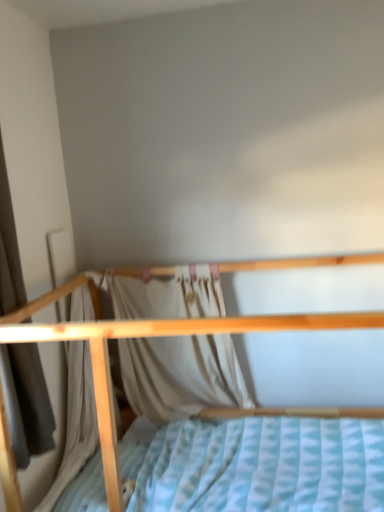
From the picture: Measure the distance between wooden bed at center and camera.

Answer: wooden bed at center and camera are 3.88 feet apart.

Measure the distance between light beige fabric curtain at left, which ranks as the first curtain in left-to-right order, and camera.

light beige fabric curtain at left, which ranks as the first curtain in left-to-right order, is 4.75 feet away from camera.

Based on the photo, measure the distance between point (190, 271) and camera.

Point (190, 271) and camera are 2.30 meters apart from each other.

Locate an element on the screen. The width and height of the screenshot is (384, 512). wooden bed at center is located at coordinates tap(149, 336).

Considering the positions of objects light beige fabric curtain at left, which ranks as the first curtain in front-to-back order, and wooden bed at center in the image provided, who is more to the left, light beige fabric curtain at left, which ranks as the first curtain in front-to-back order, or wooden bed at center?

Positioned to the left is light beige fabric curtain at left, which ranks as the first curtain in front-to-back order.

Measure the distance from light beige fabric curtain at left, which is the second curtain from back to front, to wooden bed at center.

light beige fabric curtain at left, which is the second curtain from back to front, and wooden bed at center are 14.55 inches apart.

From the image's perspective, which curtain is the 2nd one above the wooden bed at center? Please provide its 2D coordinates.

[(26, 401)]

Is white fabric curtain at center, the second curtain when ordered from front to back, bigger than wooden bed at center?

No.

Looking at this image, from the image's perspective, between white fabric curtain at center, which is the 1th curtain in right-to-left order, and wooden bed at center, who is located below?

From the image's view, wooden bed at center is below.

Is white fabric curtain at center, which ranks as the first curtain in back-to-front order, placed right next to wooden bed at center?

No.

Who is shorter, white fabric curtain at center, the second curtain when ordered from front to back, or wooden bed at center?

white fabric curtain at center, the second curtain when ordered from front to back.

Consider the image. Looking at the image, does wooden bed at center seem bigger or smaller compared to light beige fabric curtain at left, which ranks as the first curtain in left-to-right order?

In the image, wooden bed at center appears to be larger than light beige fabric curtain at left, which ranks as the first curtain in left-to-right order.

Is wooden bed at center closer to camera compared to light beige fabric curtain at left, positioned as the 2th curtain in right-to-left order?

Yes, wooden bed at center is in front of light beige fabric curtain at left, positioned as the 2th curtain in right-to-left order.

Is wooden bed at center to the right of light beige fabric curtain at left, which ranks as the first curtain in left-to-right order, from the viewer's perspective?

Correct, you'll find wooden bed at center to the right of light beige fabric curtain at left, which ranks as the first curtain in left-to-right order.

In the scene shown: Considering the relative sizes of light beige fabric curtain at left, which ranks as the first curtain in front-to-back order, and white fabric curtain at center, which is the 1th curtain in right-to-left order, in the image provided, is light beige fabric curtain at left, which ranks as the first curtain in front-to-back order, bigger than white fabric curtain at center, which is the 1th curtain in right-to-left order,?

Indeed, light beige fabric curtain at left, which ranks as the first curtain in front-to-back order, has a larger size compared to white fabric curtain at center, which is the 1th curtain in right-to-left order.

From a real-world perspective, is light beige fabric curtain at left, which ranks as the first curtain in front-to-back order, over white fabric curtain at center, the second curtain when ordered from front to back?

Yes.

Based on the photo, does light beige fabric curtain at left, positioned as the 2th curtain in right-to-left order, have a lesser height compared to white fabric curtain at center, which ranks as the first curtain in back-to-front order?

Incorrect, the height of light beige fabric curtain at left, positioned as the 2th curtain in right-to-left order, does not fall short of that of white fabric curtain at center, which ranks as the first curtain in back-to-front order.

Looking at this image, choose the correct answer: Is light beige fabric curtain at left, which ranks as the first curtain in front-to-back order, inside white fabric curtain at center, the second curtain when ordered from front to back, or outside it?

light beige fabric curtain at left, which ranks as the first curtain in front-to-back order, cannot be found inside white fabric curtain at center, the second curtain when ordered from front to back.

Can you tell me how much white fabric curtain at center, the second curtain when ordered from front to back, and light beige fabric curtain at left, which is the second curtain from back to front, differ in facing direction?

88.8 degrees.

Does point (168, 395) come closer to viewer compared to point (44, 394)?

That is False.

Does white fabric curtain at center, which ranks as the first curtain in back-to-front order, have a lesser width compared to light beige fabric curtain at left, which ranks as the first curtain in left-to-right order?

Correct, the width of white fabric curtain at center, which ranks as the first curtain in back-to-front order, is less than that of light beige fabric curtain at left, which ranks as the first curtain in left-to-right order.

Which of these two, white fabric curtain at center, marked as the second curtain in a left-to-right arrangement, or light beige fabric curtain at left, which ranks as the first curtain in front-to-back order, stands taller?

light beige fabric curtain at left, which ranks as the first curtain in front-to-back order, is taller.

Locate an element on the screen. bed that is under the white fabric curtain at center, which ranks as the first curtain in back-to-front order (from a real-world perspective) is located at coordinates (149, 336).

Between wooden bed at center and white fabric curtain at center, the second curtain when ordered from front to back, which one has smaller width?

Thinner between the two is white fabric curtain at center, the second curtain when ordered from front to back.

Consider the image. Can you confirm if wooden bed at center is positioned to the left of white fabric curtain at center, which is the 1th curtain in right-to-left order?

In fact, wooden bed at center is to the right of white fabric curtain at center, which is the 1th curtain in right-to-left order.

You are a GUI agent. You are given a task and a screenshot of the screen. Output one action in this format:
    pyautogui.click(x=<x>, y=<y>)
    Task: Click on the 2nd curtain counting from the left side of the wooden bed at center
    The width and height of the screenshot is (384, 512).
    Given the screenshot: What is the action you would take?
    pyautogui.click(x=26, y=401)

Locate an element on the screen. Image resolution: width=384 pixels, height=512 pixels. bed in front of the white fabric curtain at center, which is the 1th curtain in right-to-left order is located at coordinates (149, 336).

Consider the image. Considering their positions, is white fabric curtain at center, which is the 1th curtain in right-to-left order, positioned closer to light beige fabric curtain at left, which ranks as the first curtain in left-to-right order, than wooden bed at center?

The object closer to light beige fabric curtain at left, which ranks as the first curtain in left-to-right order, is wooden bed at center.

From the image, which object appears to be nearer to wooden bed at center, white fabric curtain at center, the second curtain when ordered from front to back, or light beige fabric curtain at left, which ranks as the first curtain in front-to-back order?

light beige fabric curtain at left, which ranks as the first curtain in front-to-back order, is closer to wooden bed at center.

Looking at the image, which one is located closer to white fabric curtain at center, the second curtain when ordered from front to back, light beige fabric curtain at left, which ranks as the first curtain in front-to-back order, or wooden bed at center?

wooden bed at center is closer to white fabric curtain at center, the second curtain when ordered from front to back.

From the picture: Looking at the image, which one is located further to white fabric curtain at center, marked as the second curtain in a left-to-right arrangement, wooden bed at center or light beige fabric curtain at left, which ranks as the first curtain in front-to-back order?

light beige fabric curtain at left, which ranks as the first curtain in front-to-back order, lies further to white fabric curtain at center, marked as the second curtain in a left-to-right arrangement, than the other object.

Considering their positions, is light beige fabric curtain at left, which is the second curtain from back to front, positioned closer to wooden bed at center than white fabric curtain at center, which ranks as the first curtain in back-to-front order?

The object closer to wooden bed at center is light beige fabric curtain at left, which is the second curtain from back to front.

Based on their spatial positions, is wooden bed at center or white fabric curtain at center, marked as the second curtain in a left-to-right arrangement, further from light beige fabric curtain at left, which is the second curtain from back to front?

Among the two, white fabric curtain at center, marked as the second curtain in a left-to-right arrangement, is located further to light beige fabric curtain at left, which is the second curtain from back to front.

The width and height of the screenshot is (384, 512). In order to click on curtain between wooden bed at center and white fabric curtain at center, marked as the second curtain in a left-to-right arrangement, in the front-back direction in this screenshot , I will do (26, 401).